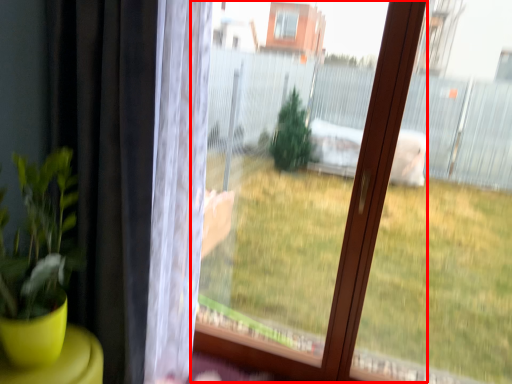
Question: In this image, where is bay window (annotated by the red box) located relative to curtain?

Choices:
 (A) right
 (B) left

Answer: (A)